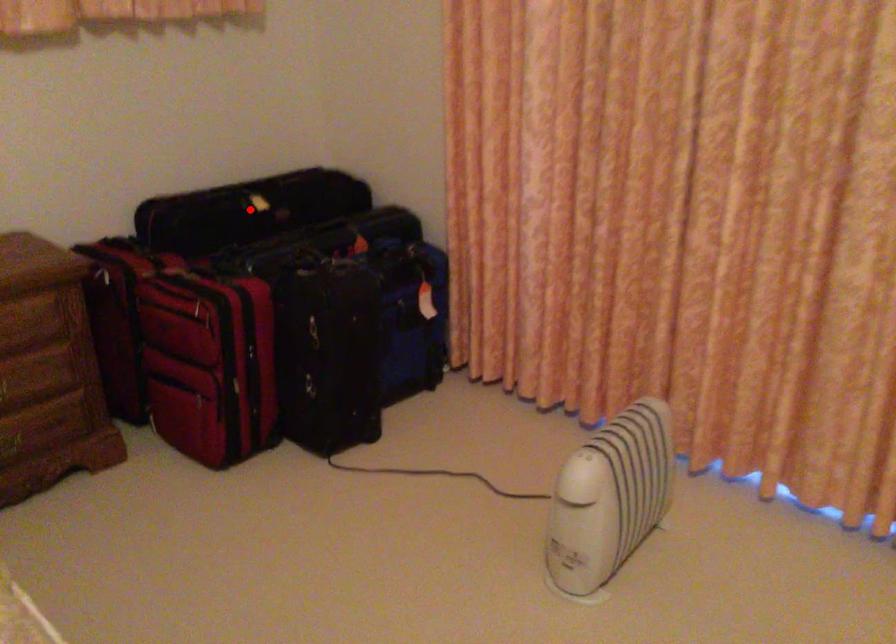
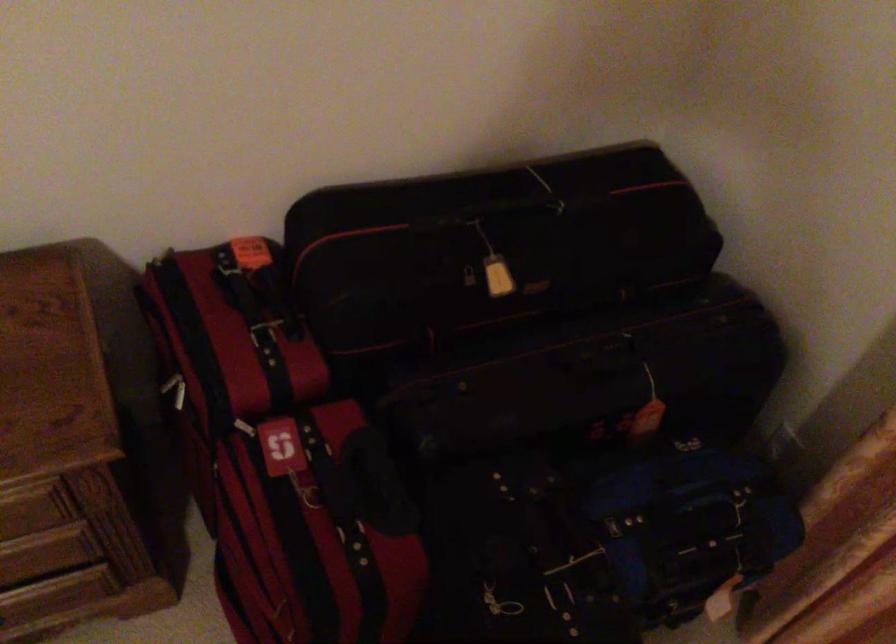
Question: I am providing you with two images of the same scene from different viewpoints. Given a red point in image1, look at the same physical point in image2. Is it:

Choices:
 (A) Closer to the viewpoint
 (B) Farther from the viewpoint

Answer: (A)